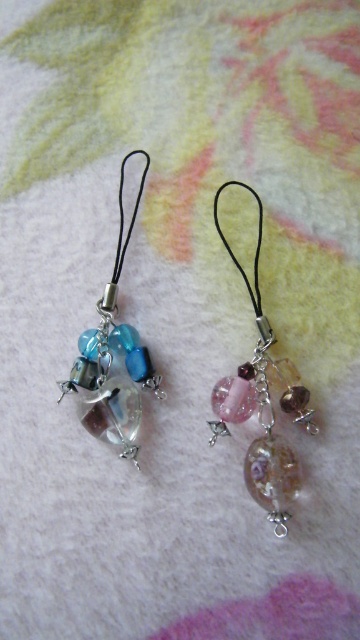
Who is more forward, [272,444] or [115,285]?

Point [272,444] is more forward.

Is translucent pink glass charm at center smaller than translucent glass charm at left?

Actually, translucent pink glass charm at center might be larger than translucent glass charm at left.

Between point (262, 387) and point (141, 378), which one is positioned in front?

Positioned in front is point (262, 387).

Where is `translucent pink glass charm at center`? The width and height of the screenshot is (360, 640). translucent pink glass charm at center is located at coordinates (263, 403).